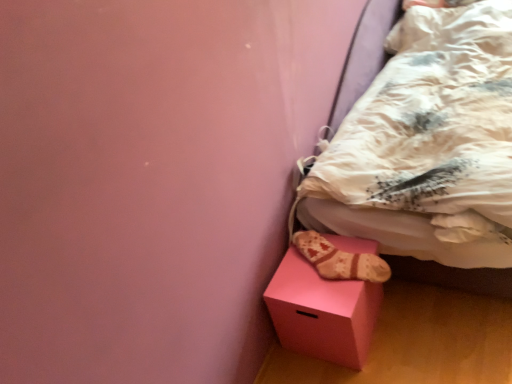
Question: Could you tell me if pink matte cube at lower right is turned towards beige fabric sock at lower right?

Choices:
 (A) no
 (B) yes

Answer: (A)

Question: From a real-world perspective, is pink matte cube at lower right under beige fabric sock at lower right?

Choices:
 (A) no
 (B) yes

Answer: (B)

Question: Is pink matte cube at lower right next to beige fabric sock at lower right?

Choices:
 (A) yes
 (B) no

Answer: (B)

Question: Is beige fabric sock at lower right at the back of pink matte cube at lower right?

Choices:
 (A) yes
 (B) no

Answer: (B)

Question: Is pink matte cube at lower right further to camera compared to beige fabric sock at lower right?

Choices:
 (A) yes
 (B) no

Answer: (B)

Question: Is pink matte cube at lower right located outside beige fabric sock at lower right?

Choices:
 (A) yes
 (B) no

Answer: (A)

Question: Would you say beige fabric sock at lower right is outside white textured bed at lower right?

Choices:
 (A) yes
 (B) no

Answer: (A)

Question: Can you confirm if beige fabric sock at lower right is smaller than white textured bed at lower right?

Choices:
 (A) no
 (B) yes

Answer: (B)

Question: Is beige fabric sock at lower right to the right of white textured bed at lower right from the viewer's perspective?

Choices:
 (A) yes
 (B) no

Answer: (B)

Question: From the image's perspective, would you say beige fabric sock at lower right is positioned over white textured bed at lower right?

Choices:
 (A) yes
 (B) no

Answer: (B)

Question: Is beige fabric sock at lower right next to white textured bed at lower right and touching it?

Choices:
 (A) yes
 (B) no

Answer: (B)

Question: Is beige fabric sock at lower right shorter than white textured bed at lower right?

Choices:
 (A) yes
 (B) no

Answer: (A)

Question: Is white textured bed at lower right located outside pink matte cube at lower right?

Choices:
 (A) no
 (B) yes

Answer: (B)